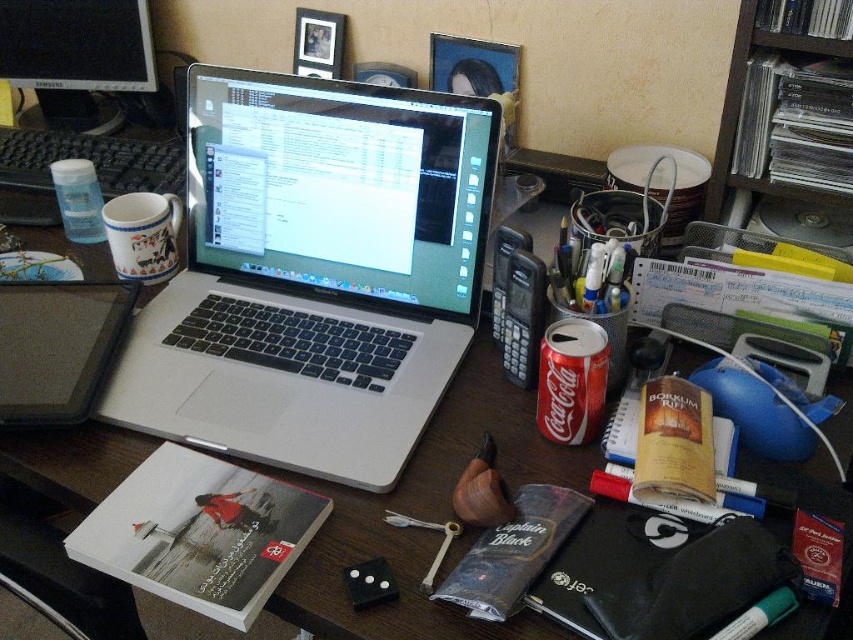
You are organizing items on your desk and need to place a new item between the black glossy computer monitor at upper left and the white ceramic mug at left. Is there enough space between them to fit a standard notebook?

The black glossy computer monitor at upper left is positioned to the left of the white ceramic mug at left, so there is space between them. A standard notebook should fit between them.

You are organizing the items on the desk and want to place a new item between the black glossy computer monitor at upper left and the black plastic case at left. Can you fit it there without moving either of them?

The distance between the black glossy computer monitor at upper left and the black plastic case at left is 64.53 centimeters. Since the space is quite large, you should be able to fit the new item between them without moving either object.

You have a small box that needs to be placed on the desk. The box is exactly the same size as the white ceramic mug at left. Can you fit the box next to the silver metallic laptop at center without moving any other items?

The silver metallic laptop at center is bigger than the white ceramic mug at left. Since the box is the same size as the mug, it might be possible to fit it next to the laptop, but you would need to ensure there is enough space considering the laptop takes up more space. However, since the exact dimensions of the desk and other items aren